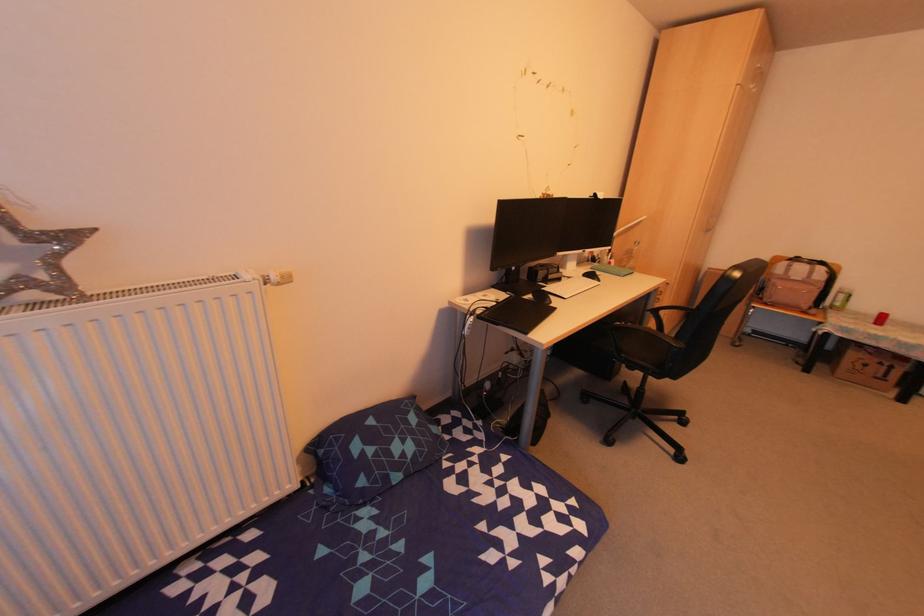
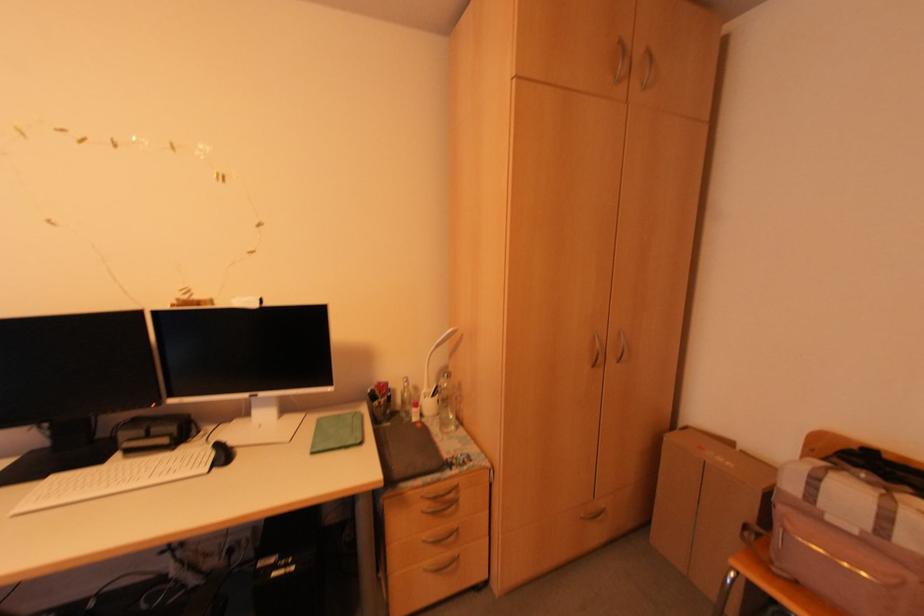
The point at [797,280] is marked in the first image. Where is the corresponding point in the second image?

(854, 532)